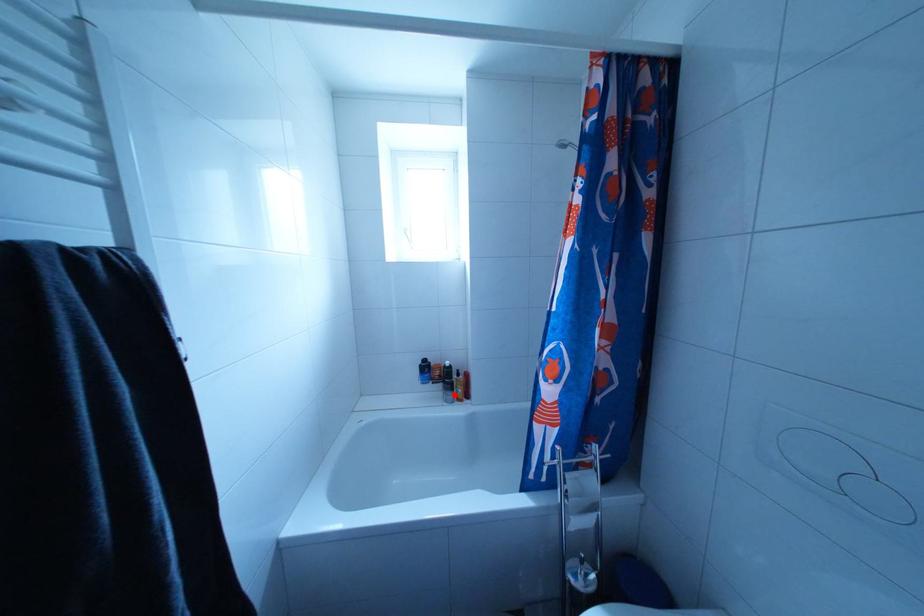
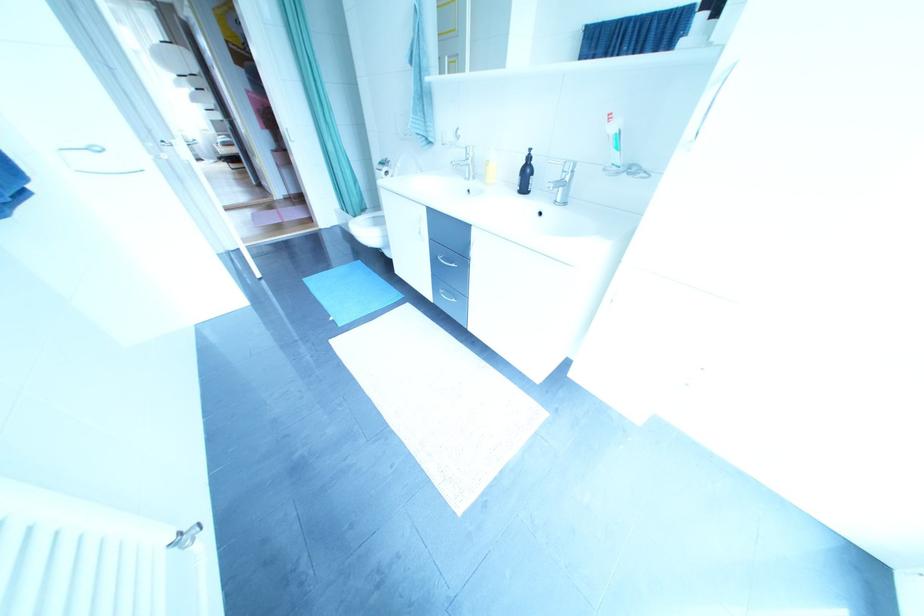
Question: I am providing you with two images of the same scene from different viewpoints. A red point is marked on the first image. At the location where the point appears in image 1, is it still visible in image 2?

Choices:
 (A) Yes
 (B) No

Answer: (B)